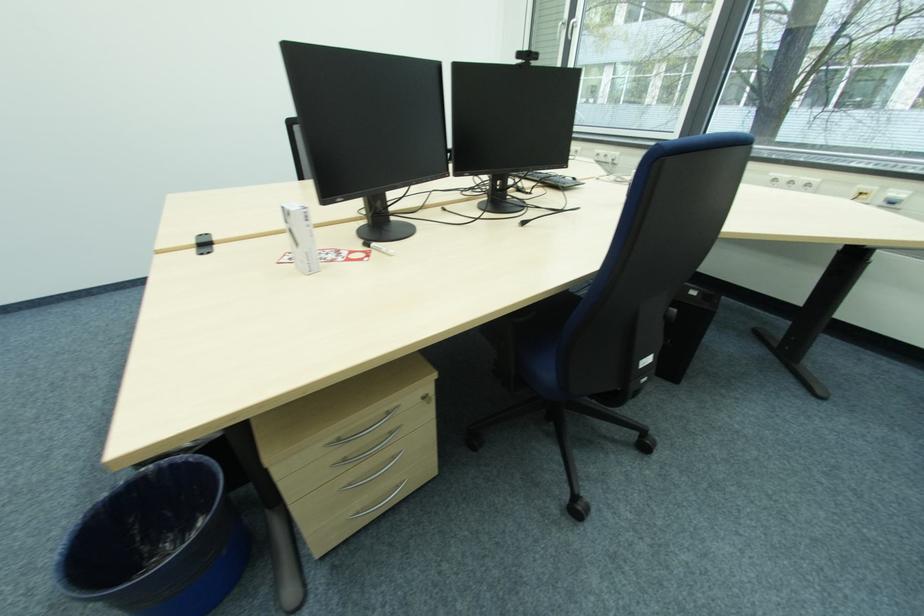
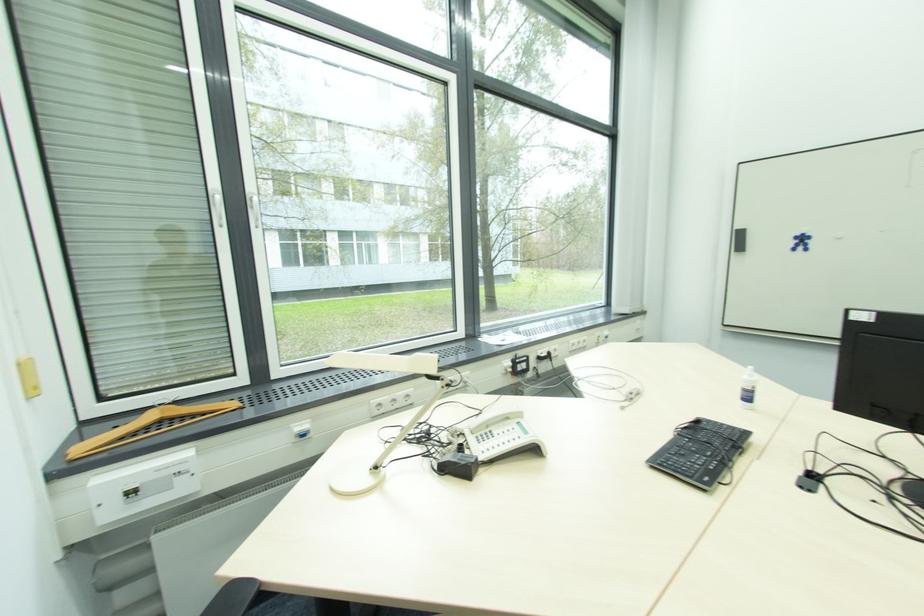
Locate, in the second image, the point that corresponds to point (577, 180) in the first image.

(700, 424)